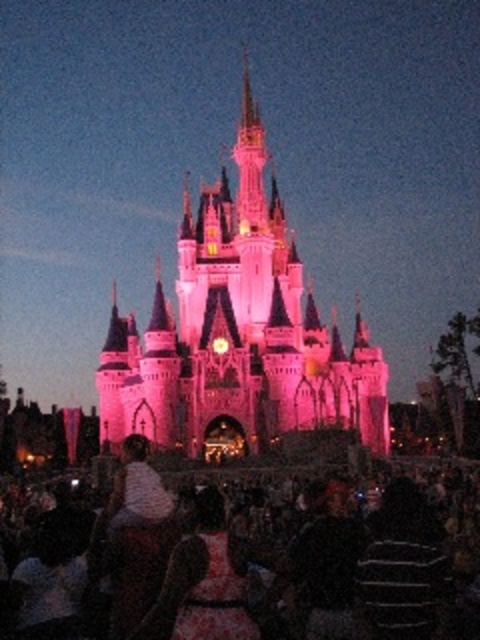
Question: Which object appears farthest from the camera in this image?

Choices:
 (A) pink stone castle at center
 (B) matte pink dress at lower center

Answer: (A)

Question: Is the position of pink stone castle at center less distant than that of matte pink dress at lower center?

Choices:
 (A) yes
 (B) no

Answer: (B)

Question: From the image, what is the correct spatial relationship of pink stone castle at center in relation to matte pink dress at lower center?

Choices:
 (A) above
 (B) below

Answer: (A)

Question: Which object is farther from the camera taking this photo?

Choices:
 (A) pink stone castle at center
 (B) matte pink dress at lower center

Answer: (A)

Question: Is pink stone castle at center smaller than matte pink dress at lower center?

Choices:
 (A) no
 (B) yes

Answer: (A)